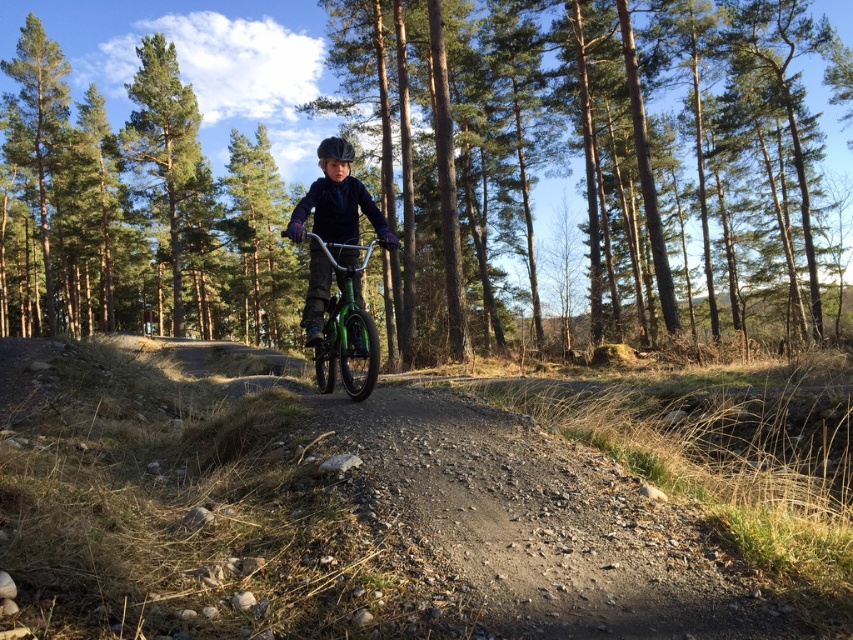
Does green matte tree at upper left appear over matte black helmet at center?

No.

Consider the image. Measure the distance between green matte tree at upper left and matte black helmet at center.

They are 15.57 meters apart.

Is point (134, 116) farther from viewer compared to point (334, 145)?

Yes, point (134, 116) is farther from viewer.

Where is `green matte tree at upper left`? green matte tree at upper left is located at coordinates (163, 138).

Can you confirm if green metallic bicycle at center is taller than green matte tree at upper left?

Yes.

Is green metallic bicycle at center in front of green matte tree at upper left?

Yes, it is.

Between point (20, 268) and point (144, 102), which one is positioned behind?

The point (20, 268) is more distant.

This screenshot has width=853, height=640. Find the location of `green metallic bicycle at center`. green metallic bicycle at center is located at coordinates (590, 161).

Who is more distant from viewer, (532, 35) or (332, 257)?

Positioned behind is point (532, 35).

Is point (422, 58) less distant than point (369, 381)?

No, (422, 58) is behind (369, 381).

The width and height of the screenshot is (853, 640). What do you see at coordinates (590, 161) in the screenshot?
I see `green metallic bicycle at center` at bounding box center [590, 161].

Where is `green metallic bicycle at center`? This screenshot has height=640, width=853. green metallic bicycle at center is located at coordinates (590, 161).